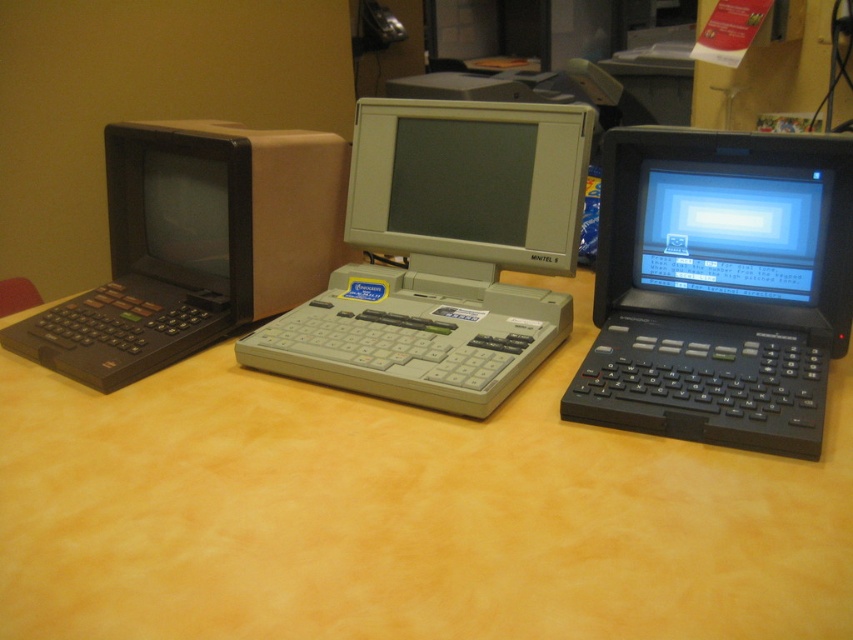
Is point (125, 138) positioned behind point (482, 170)?

Yes, point (125, 138) is behind point (482, 170).

Can you confirm if matte black laptop at left is positioned above matte gray monitor at center?

Actually, matte black laptop at left is below matte gray monitor at center.

Is point (154, 227) positioned before point (375, 145)?

No, it is behind (375, 145).

You are a GUI agent. You are given a task and a screenshot of the screen. Output one action in this format:
    pyautogui.click(x=<x>, y=<y>)
    Task: Click on the matte black laptop at left
    The width and height of the screenshot is (853, 640).
    Given the screenshot: What is the action you would take?
    pyautogui.click(x=196, y=244)

Who is lower down, yellow wood table at center or gray plastic computer at center?

yellow wood table at center

Which is behind, point (270, 438) or point (502, 216)?

Positioned behind is point (502, 216).

The image size is (853, 640). I want to click on yellow wood table at center, so click(401, 513).

Is point (798, 237) positioned in front of point (514, 120)?

Yes.

Between black plastic laptop at right and gray plastic computer at center, which one appears on the right side from the viewer's perspective?

Positioned to the right is black plastic laptop at right.

This screenshot has width=853, height=640. What do you see at coordinates (718, 288) in the screenshot? I see `black plastic laptop at right` at bounding box center [718, 288].

You are a GUI agent. You are given a task and a screenshot of the screen. Output one action in this format:
    pyautogui.click(x=<x>, y=<y>)
    Task: Click on the black plastic laptop at right
    The height and width of the screenshot is (640, 853).
    Given the screenshot: What is the action you would take?
    pyautogui.click(x=718, y=288)